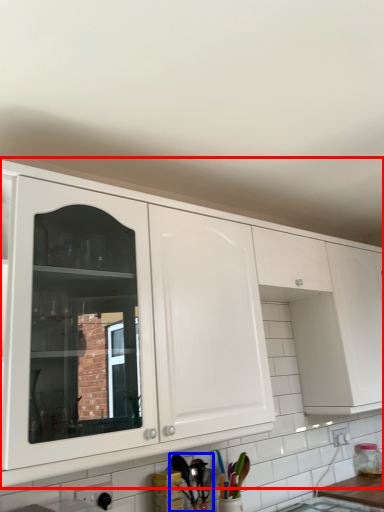
Question: Which point is closer to the camera, cabinetry (highlighted by a red box) or cutlery (highlighted by a blue box)?

Choices:
 (A) cabinetry
 (B) cutlery

Answer: (A)